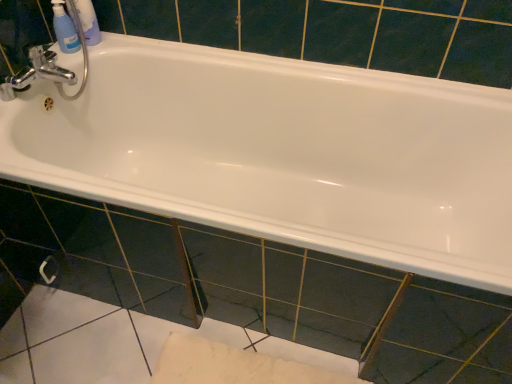
Question: Would you say silver metallic towel bar at lower left is to the left or to the right of translucent plastic bottles at upper left in the picture?

Choices:
 (A) left
 (B) right

Answer: (A)

Question: Is silver metallic towel bar at lower left taller or shorter than translucent plastic bottles at upper left?

Choices:
 (A) tall
 (B) short

Answer: (B)

Question: Which object is the closest to the glossy ceramic tile at center?

Choices:
 (A) translucent plastic bottles at upper left
 (B) transparent plastic mouthwash at upper left
 (C) chrome metallic faucet at upper left
 (D) white glossy bathtub at center
 (E) silver metallic towel bar at lower left

Answer: (D)

Question: Estimate the real-world distances between objects in this image. Which object is closer to the translucent plastic bottles at upper left?

Choices:
 (A) white glossy bathtub at center
 (B) silver metallic towel bar at lower left
 (C) glossy ceramic tile at center
 (D) transparent plastic mouthwash at upper left
 (E) chrome metallic faucet at upper left

Answer: (D)